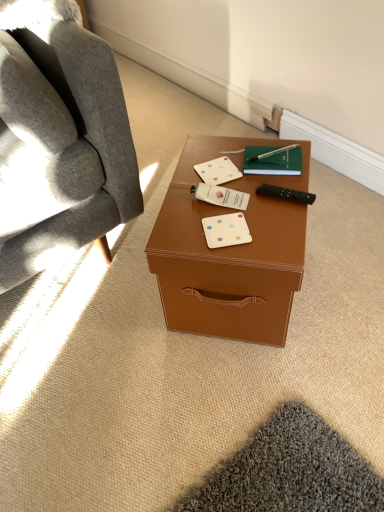
Where is `unoccupied area in front of black plastic remote control at right`? This screenshot has height=512, width=384. unoccupied area in front of black plastic remote control at right is located at coordinates (276, 234).